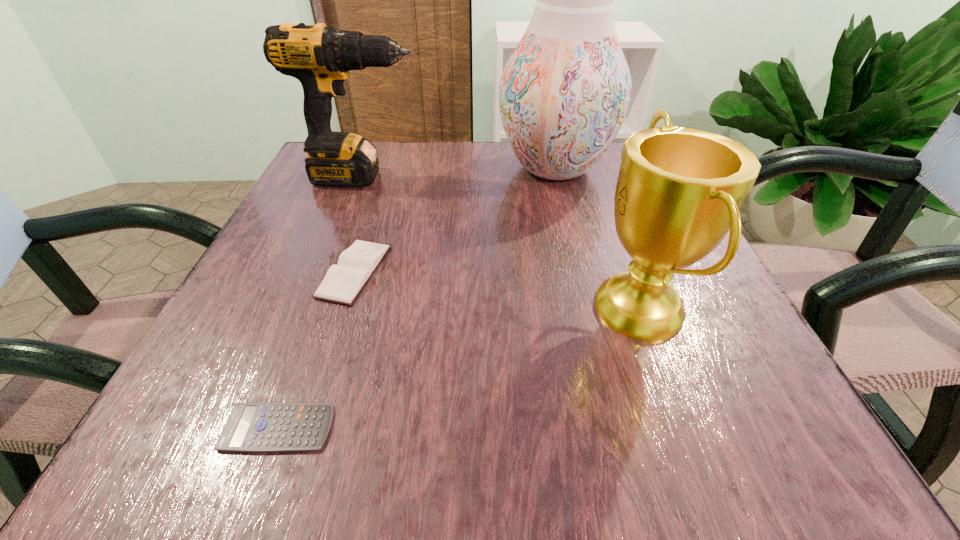
Find the location of `vase`. vase is located at coordinates (564, 93).

Locate an element on the screen. The width and height of the screenshot is (960, 540). drill is located at coordinates (320, 57).

Locate an element on the screen. award is located at coordinates (679, 190).

Identify the location of the second shortest object. This screenshot has width=960, height=540. (342, 283).

Locate an element on the screen. This screenshot has width=960, height=540. calculator is located at coordinates (268, 426).

Find the location of a particular element. Image resolution: width=960 pixels, height=540 pixels. the nearest object is located at coordinates (268, 426).

Where is `free region located 0.400m on the front of the vase`? The width and height of the screenshot is (960, 540). free region located 0.400m on the front of the vase is located at coordinates (604, 359).

The height and width of the screenshot is (540, 960). I want to click on free space located at the tip of the drill, so click(510, 177).

The image size is (960, 540). In order to click on blank space located 0.270m on the shiny surface of the award in this screenshot , I will do `click(411, 309)`.

Identify the location of vacant space positioned on the shiny surface of the award. (543, 309).